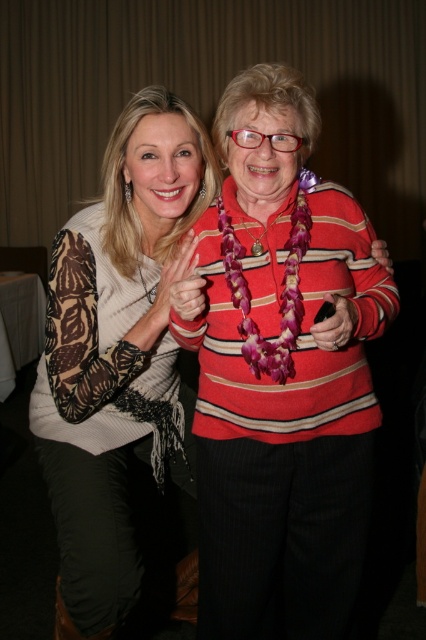
You are standing in the room and want to hand a gift to the woman wearing the striped sweater at center. Which direction should you move to reach her?

The striped sweater at center is located at point [279,376], so you should move towards the center of the room to reach the woman wearing the striped sweater at center.

You are a photographer adjusting the camera settings to focus on the striped sweater at center and the matte pink fabric at center. Which object should you adjust the focus to first if you want to capture the one that is more to the right?

The striped sweater at center is positioned on the right side of matte pink fabric at center, so you should focus on the striped sweater at center first since it is more to the right.